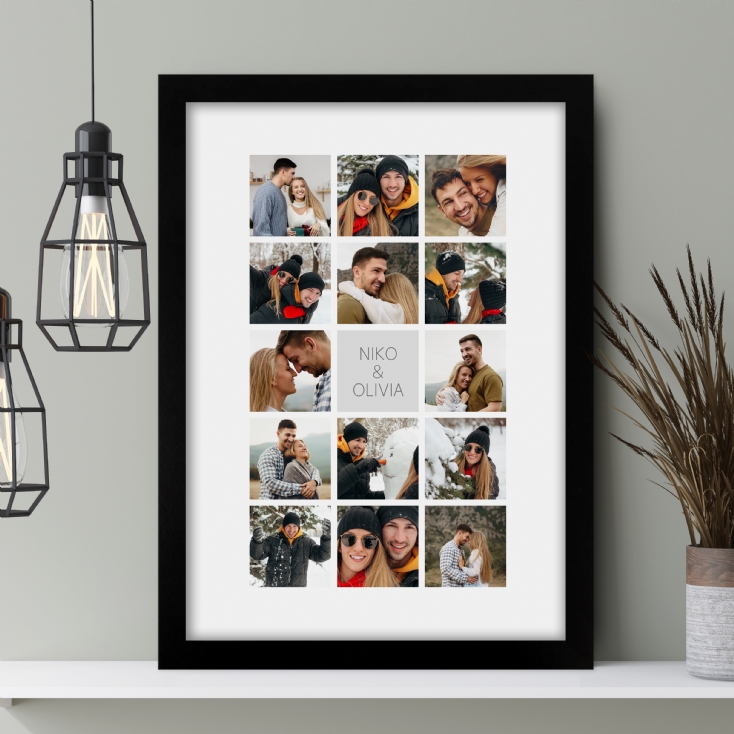
Find the location of a particular element. The image size is (734, 734). edges of a black frame is located at coordinates (360, 655), (172, 357), (379, 84), (575, 355).